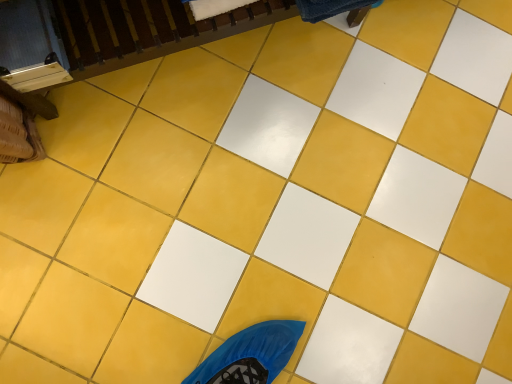
In the scene shown: Measure the distance between matte wood bench at upper center and camera.

They are 28.85 inches apart.

Image resolution: width=512 pixels, height=384 pixels. What do you see at coordinates (149, 46) in the screenshot?
I see `matte wood bench at upper center` at bounding box center [149, 46].

At what (x,y) coordinates should I click in order to perform the action: click on matte wood bench at upper center. Please return your answer as a coordinate pair (x, y). This screenshot has width=512, height=384. Looking at the image, I should click on (149, 46).

This screenshot has width=512, height=384. What are the coordinates of `matte wood bench at upper center` in the screenshot? It's located at coord(149,46).